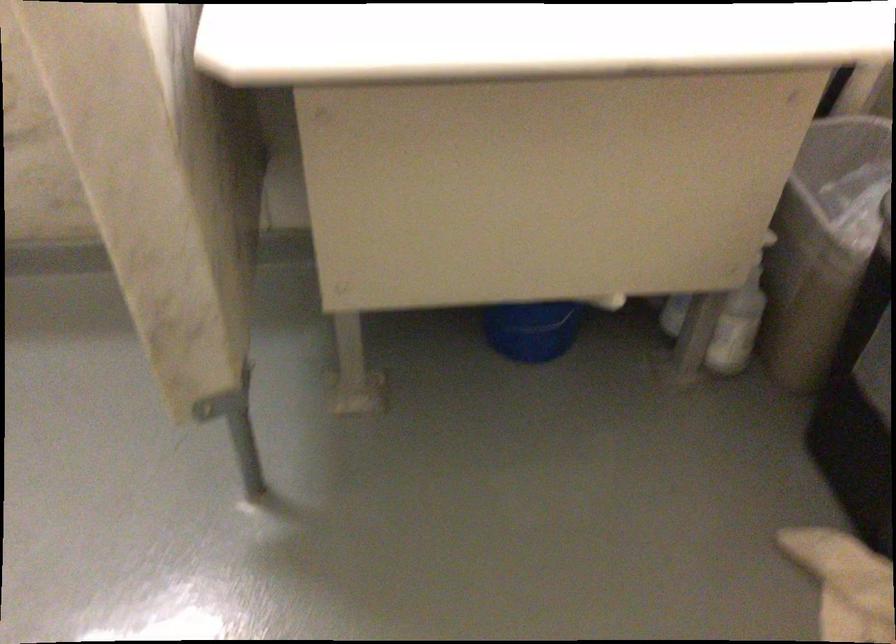
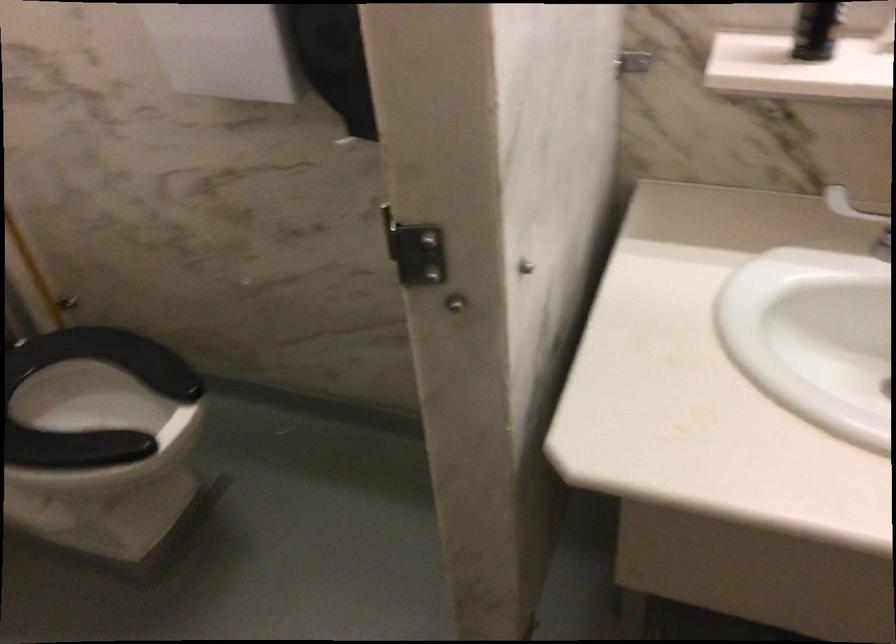
Question: What movement of the cameraman would produce the second image?

Choices:
 (A) Left
 (B) Right
 (C) Forward
 (D) Backward

Answer: (D)